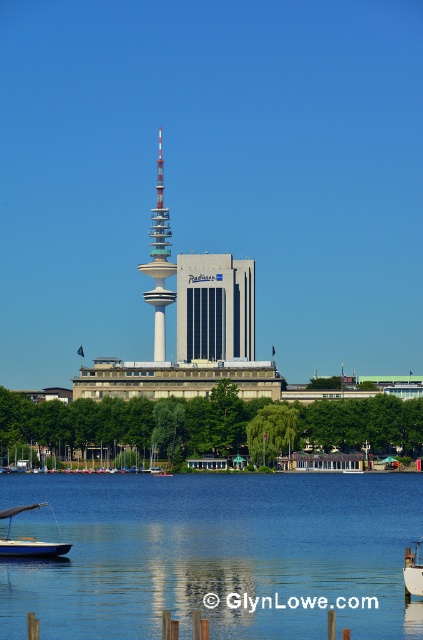
You are a photographer standing at the waterfront and want to capture the reflection of the tower and the Radisson building in the blue liquid water at center. Considering the distance, will the reflection be clear and visible in your photo?

The blue liquid water at center is 627.15 meters from the camera. Since reflections become less clear as distance increases, the reflection might not be clear or visible at such a far distance.

You are a photographer planning to capture the entire scene in one shot. Given that the matte glass building at center and the blue matte sailboat at lower left are both in your frame, which object will occupy more of the photo? Explain your reasoning based on their sizes.

The matte glass building at center will occupy more of the photo because it is larger in size than the blue matte sailboat at lower left according to the description.